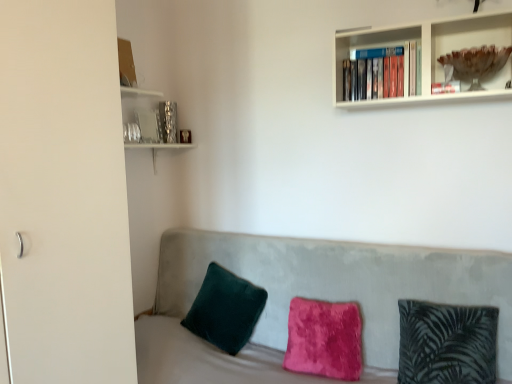
Question: Is translucent glass bowl at upper right positioned in front of velvet couch at center?

Choices:
 (A) no
 (B) yes

Answer: (A)

Question: From the image's perspective, would you say translucent glass bowl at upper right is positioned over velvet couch at center?

Choices:
 (A) yes
 (B) no

Answer: (A)

Question: From a real-world perspective, is translucent glass bowl at upper right below velvet couch at center?

Choices:
 (A) no
 (B) yes

Answer: (A)

Question: Does translucent glass bowl at upper right contain velvet couch at center?

Choices:
 (A) yes
 (B) no

Answer: (B)

Question: From the image's perspective, is translucent glass bowl at upper right under velvet couch at center?

Choices:
 (A) yes
 (B) no

Answer: (B)

Question: Is translucent glass bowl at upper right facing towards velvet couch at center?

Choices:
 (A) no
 (B) yes

Answer: (A)

Question: Can you confirm if velvet green pillow at left, placed as the first pillow when sorted from left to right, is bigger than velvet couch at center?

Choices:
 (A) yes
 (B) no

Answer: (B)

Question: Is velvet green pillow at left, placed as the first pillow when sorted from left to right, placed right next to velvet couch at center?

Choices:
 (A) yes
 (B) no

Answer: (B)

Question: Can you confirm if velvet green pillow at left, placed as the first pillow when sorted from left to right, is taller than velvet couch at center?

Choices:
 (A) no
 (B) yes

Answer: (A)

Question: Is velvet green pillow at left, which appears as the 3th pillow when viewed from the right, to the left of velvet couch at center from the viewer's perspective?

Choices:
 (A) no
 (B) yes

Answer: (B)

Question: Considering the relative sizes of velvet green pillow at left, which appears as the 3th pillow when viewed from the right, and velvet couch at center in the image provided, is velvet green pillow at left, which appears as the 3th pillow when viewed from the right, shorter than velvet couch at center?

Choices:
 (A) yes
 (B) no

Answer: (A)

Question: Does velvet green pillow at left, placed as the first pillow when sorted from left to right, have a lesser width compared to velvet couch at center?

Choices:
 (A) no
 (B) yes

Answer: (B)

Question: Does velvet couch at center appear on the left side of velvet green pillow at left, which appears as the 3th pillow when viewed from the right?

Choices:
 (A) yes
 (B) no

Answer: (B)